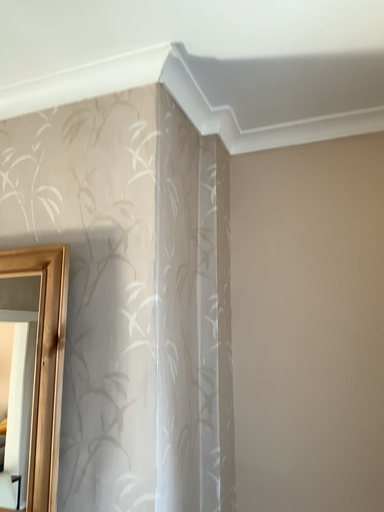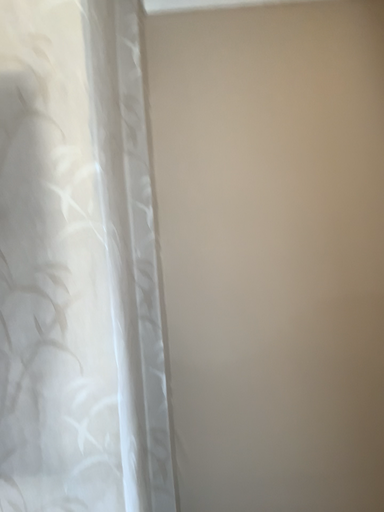
Question: Which way did the camera rotate in the video?

Choices:
 (A) rotated downward
 (B) rotated upward

Answer: (A)